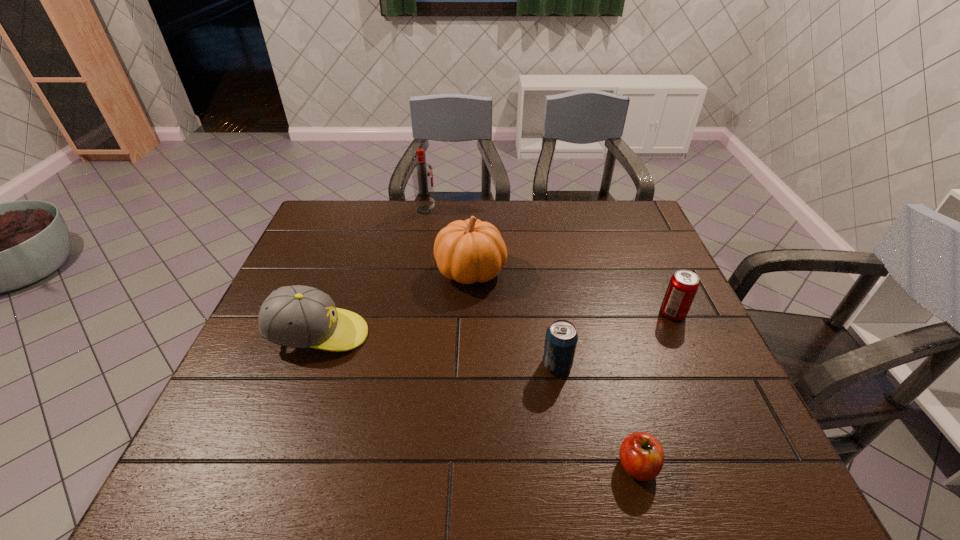
Locate an element on the screen. This screenshot has height=540, width=960. free space between the left pop soda and the second object from left to right is located at coordinates (492, 287).

The image size is (960, 540). In order to click on free spot between the leftmost object and the nearer pop soda in this screenshot , I will do `click(438, 350)`.

Identify the location of free spot between the left pop soda and the pumpkin. This screenshot has width=960, height=540. (514, 318).

Image resolution: width=960 pixels, height=540 pixels. I want to click on free space between the leftmost object and the left pop soda, so click(x=438, y=350).

You are a GUI agent. You are given a task and a screenshot of the screen. Output one action in this format:
    pyautogui.click(x=<x>, y=<y>)
    Task: Click on the free point between the leftmost object and the fifth object from left to right
    
    Given the screenshot: What is the action you would take?
    pyautogui.click(x=478, y=400)

The width and height of the screenshot is (960, 540). Identify the location of free space between the fifth shortest object and the fourth object from left to right. [514, 318].

I want to click on free space between the farthest object and the nearest object, so click(x=532, y=338).

The height and width of the screenshot is (540, 960). I want to click on the fifth closest object to the tallest object, so click(641, 455).

This screenshot has width=960, height=540. Identify the location of the closest object to the nearer pop soda. (641, 455).

Locate an element on the screen. The image size is (960, 540). free region that satisfies the following two spatial constraints: 1. on the front-facing side of the baseball cap; 2. on the back side of the second object from right to left is located at coordinates (271, 465).